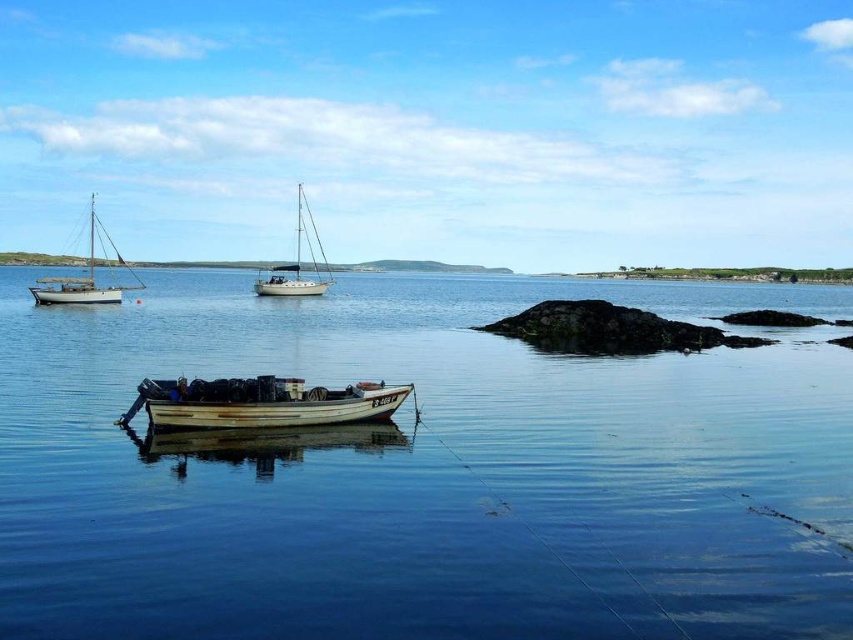
Is clear water at center taller than white glossy sailboat at center?

Incorrect, clear water at center's height is not larger of white glossy sailboat at center's.

Measure the distance between clear water at center and white glossy sailboat at center.

clear water at center is 100.03 feet from white glossy sailboat at center.

Which is in front, point (286, 540) or point (300, 294)?

Point (286, 540)

Locate an element on the screen. The height and width of the screenshot is (640, 853). clear water at center is located at coordinates (426, 470).

Can you confirm if clear water at center is positioned above white matte sailboat at left?

Actually, clear water at center is below white matte sailboat at left.

Does clear water at center have a smaller size compared to white matte sailboat at left?

Indeed, clear water at center has a smaller size compared to white matte sailboat at left.

Who is more forward, (757, 497) or (47, 278)?

Point (757, 497) is more forward.

The height and width of the screenshot is (640, 853). Identify the location of clear water at center. (426, 470).

Is point (320, 412) in front of point (125, 266)?

Yes, it is.

Based on the photo, which is below, rusty metal boat at center or white matte sailboat at left?

rusty metal boat at center is below.

Is point (189, 385) closer to camera compared to point (93, 202)?

That is True.

In order to click on rusty metal boat at center in this screenshot , I will do `click(260, 403)`.